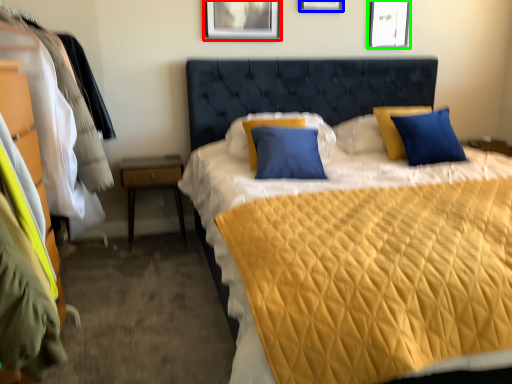
Question: Which is farther away from picture frame (highlighted by a red box)? picture frame (highlighted by a blue box) or picture frame (highlighted by a green box)?

Choices:
 (A) picture frame
 (B) picture frame

Answer: (B)